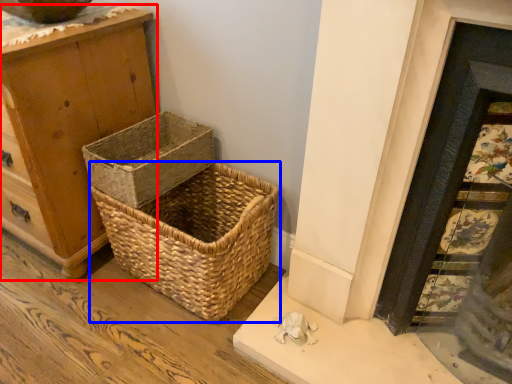
Question: Which point is further to the camera, chest of drawers (highlighted by a red box) or picnic basket (highlighted by a blue box)?

Choices:
 (A) chest of drawers
 (B) picnic basket

Answer: (B)